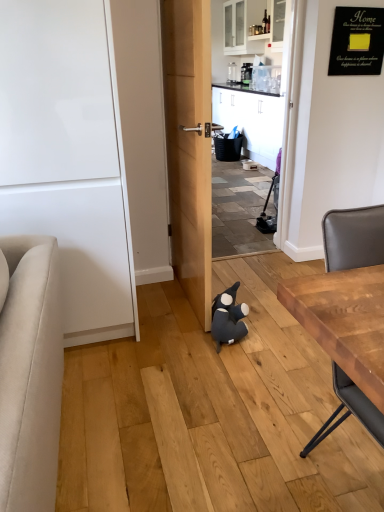
Question: Considering the relative sizes of dark blue plush toy at center and wooden table at right in the image provided, is dark blue plush toy at center smaller than wooden table at right?

Choices:
 (A) no
 (B) yes

Answer: (B)

Question: Would you say dark blue plush toy at center contains wooden table at right?

Choices:
 (A) yes
 (B) no

Answer: (B)

Question: From a real-world perspective, is dark blue plush toy at center physically above wooden table at right?

Choices:
 (A) no
 (B) yes

Answer: (A)

Question: Is dark blue plush toy at center positioned with its back to wooden table at right?

Choices:
 (A) no
 (B) yes

Answer: (A)

Question: Can you confirm if dark blue plush toy at center is taller than wooden table at right?

Choices:
 (A) yes
 (B) no

Answer: (B)

Question: Is wooden table at right wider or thinner than dark blue plush toy at center?

Choices:
 (A) wide
 (B) thin

Answer: (A)

Question: From a real-world perspective, is wooden table at right physically located above or below dark blue plush toy at center?

Choices:
 (A) above
 (B) below

Answer: (A)

Question: Considering the relative positions of wooden table at right and dark blue plush toy at center in the image provided, is wooden table at right to the left or to the right of dark blue plush toy at center?

Choices:
 (A) left
 (B) right

Answer: (B)

Question: Considering the positions of wooden table at right and dark blue plush toy at center in the image, is wooden table at right taller or shorter than dark blue plush toy at center?

Choices:
 (A) short
 (B) tall

Answer: (B)

Question: Does point (x=64, y=133) appear closer or farther from the camera than point (x=223, y=325)?

Choices:
 (A) closer
 (B) farther

Answer: (A)

Question: Is white glossy door at left to the left or to the right of dark blue plush toy at center in the image?

Choices:
 (A) right
 (B) left

Answer: (B)

Question: From the image's perspective, is white glossy door at left positioned above or below dark blue plush toy at center?

Choices:
 (A) below
 (B) above

Answer: (B)

Question: In terms of height, does white glossy door at left look taller or shorter compared to dark blue plush toy at center?

Choices:
 (A) short
 (B) tall

Answer: (B)

Question: Considering the positions of wooden table at right and white glossy door at left in the image, is wooden table at right bigger or smaller than white glossy door at left?

Choices:
 (A) small
 (B) big

Answer: (A)

Question: Is wooden table at right inside the boundaries of white glossy door at left, or outside?

Choices:
 (A) outside
 (B) inside

Answer: (A)